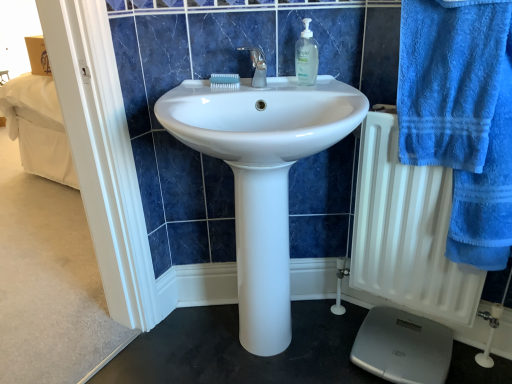
Locate an element on the screen. The width and height of the screenshot is (512, 384). free space underneath white glossy sink at center (from a real-world perspective) is located at coordinates (279, 350).